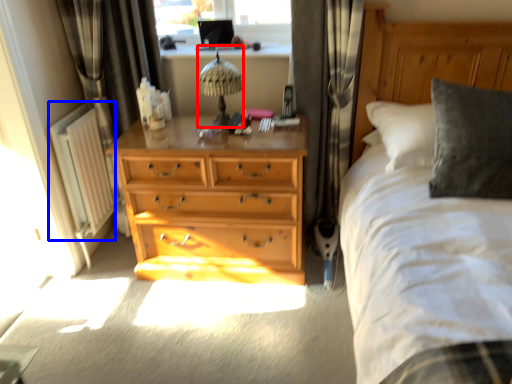
Question: Which point is further to the camera, table lamp (highlighted by a red box) or radiator (highlighted by a blue box)?

Choices:
 (A) table lamp
 (B) radiator

Answer: (B)